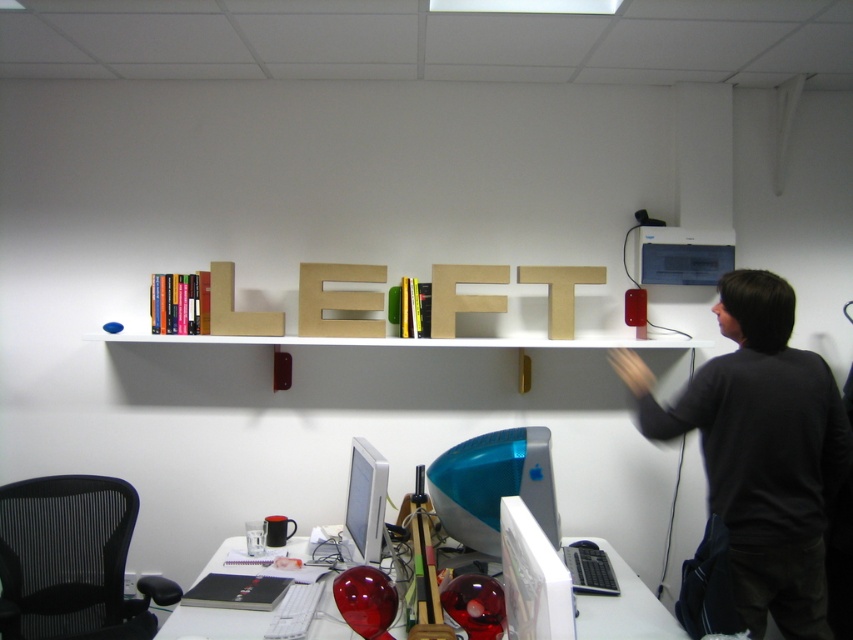
You are standing in the office and want to place a new object at the point labeled as point (822,502). Considering the existing objects in the scene, where would this new object be positioned relative to the other point, point (19,582)?

The new object placed at point (822,502) would be in front of point (19,582).

You are organizing your workspace and need to place a 24 inch laptop on the desk. The dark gray sweater at upper right is currently near the white glossy computer desk at lower center. Can the laptop fit between them without moving the sweater?

The dark gray sweater at upper right is 24.15 inches from the white glossy computer desk at lower center, so a 24 inch laptop can fit between them since the distance is slightly larger than the laptop.

You are sitting in the black mesh swivel chair at left and want to reach the white glossy computer desk at lower center. Which direction should you move to get there?

You should move to the right because the black mesh swivel chair at left is to the left of the white glossy computer desk at lower center.